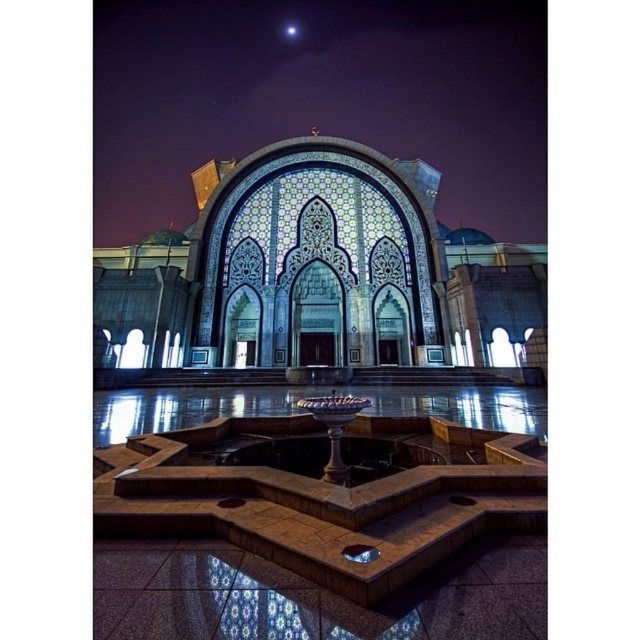
You are standing in front of the grand structure and notice both the polished stone fountain at center and the polished stone palace at center. Which object is taller?

The polished stone fountain at center is taller than the polished stone palace at center.

You are a visitor standing in front of the grand structure. You notice two objects made of polished stone. Which one is bigger between the polished stone fountain at center and the polished stone palace at center?

The polished stone fountain at center is larger in size than the polished stone palace at center.

You are standing in front of the grand structure and want to take a photo of both the polished stone fountain at center and the polished stone palace at center. Which object should you position to the left side of your camera frame to include both in the shot?

You should position the polished stone fountain at center to the left side of your camera frame because it is already located to the left of the polished stone palace at center, allowing both to be captured in the shot.